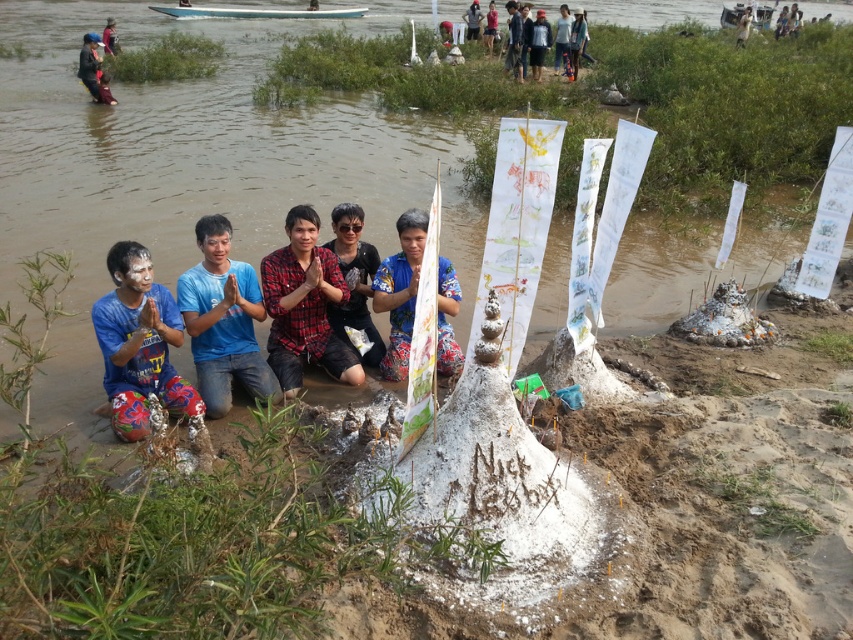
Question: Is blue printed pants at lower left below dark blue fabric at upper left?

Choices:
 (A) no
 (B) yes

Answer: (B)

Question: Is the position of blue printed pants at lower left more distant than that of matte black shirt at center?

Choices:
 (A) yes
 (B) no

Answer: (B)

Question: Among these points, which one is farthest from the camera?

Choices:
 (A) (346, 349)
 (B) (85, 68)
 (C) (123, 284)
 (D) (213, 380)

Answer: (B)

Question: Which of the following is the farthest from the observer?

Choices:
 (A) blue cotton shirt at center
 (B) matte black shirt at center

Answer: (B)

Question: Does red plaid shirt at center have a lesser width compared to printed fabric shirt at center?

Choices:
 (A) yes
 (B) no

Answer: (B)

Question: Based on their relative distances, which object is farther from the red plaid shirt at center?

Choices:
 (A) blue printed pants at lower left
 (B) dark blue fabric at upper left
 (C) printed fabric shirt at center
 (D) blue cotton shirt at center

Answer: (B)